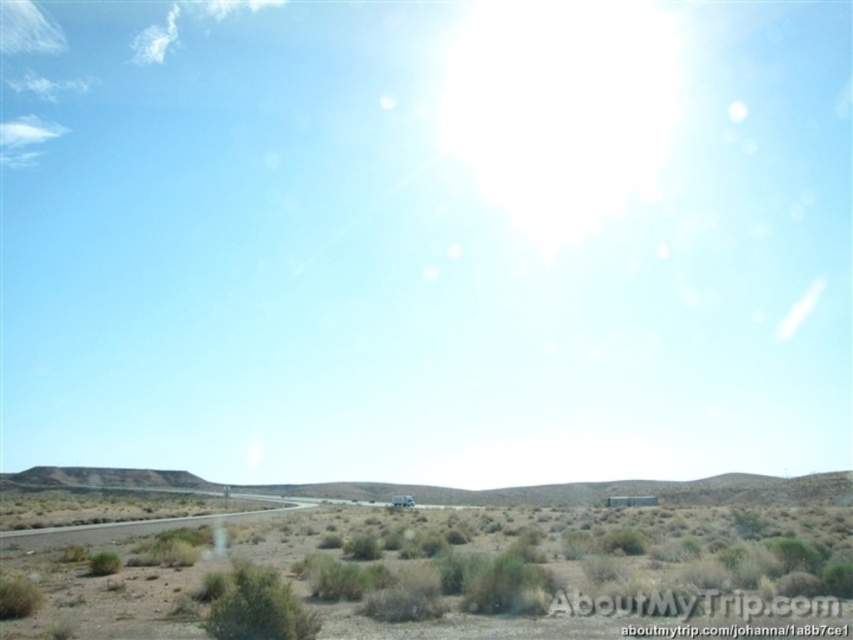
You are standing at the edge of the gray asphalt highway at lower left and want to reach the white matte truck at center. Which direction should you walk to get closer to the truck?

You should walk towards the center of the image because the gray asphalt highway at lower left is closer to the viewer than the white matte truck at center, meaning the truck is further away and located towards the center of the scene.

You are a pedestrian standing on the brown dry grass at lower center and want to cross the road to reach a destination on the other side. Is the white matte truck at center blocking your path?

The brown dry grass at lower center is located above the white matte truck at center, meaning the truck is positioned below the grass in the image. Since the truck is lower in the scene, it is likely not obstructing your path across the road. You can safely cross the road here.